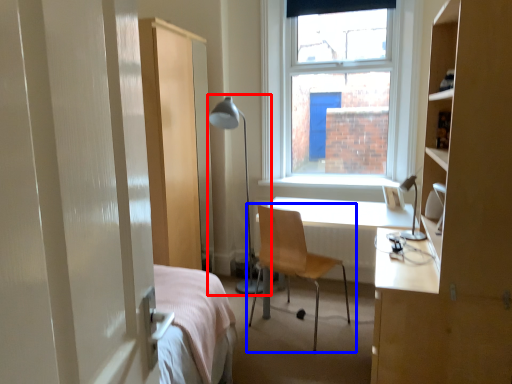
Question: Which object appears farthest to the camera in this image, table lamp (highlighted by a red box) or chair (highlighted by a blue box)?

Choices:
 (A) table lamp
 (B) chair

Answer: (A)